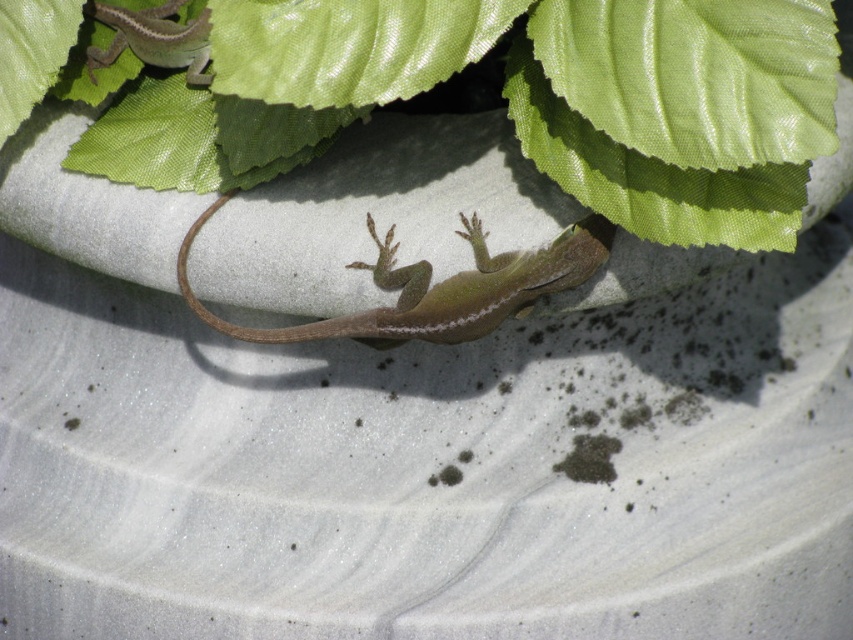
Question: Which object appears farthest from the camera in this image?

Choices:
 (A) brown matte tail at center
 (B) green glossy leaf at upper center
 (C) green leafy plant at upper center
 (D) green matte lizard at center

Answer: (A)

Question: Is green glossy leaf at upper center further to camera compared to green matte lizard at upper left?

Choices:
 (A) no
 (B) yes

Answer: (A)

Question: Which of the following is the farthest from the observer?

Choices:
 (A) (558, 12)
 (B) (567, 248)
 (C) (622, 259)
 (D) (363, 56)

Answer: (C)

Question: Does green glossy leaf at upper center come behind green matte lizard at upper left?

Choices:
 (A) yes
 (B) no

Answer: (B)

Question: Among these objects, which one is farthest from the camera?

Choices:
 (A) green glossy leaf at upper center
 (B) glossy green leaf at upper center
 (C) brown matte tail at center

Answer: (C)

Question: Is green leafy plant at upper center above brown matte tail at center?

Choices:
 (A) yes
 (B) no

Answer: (A)